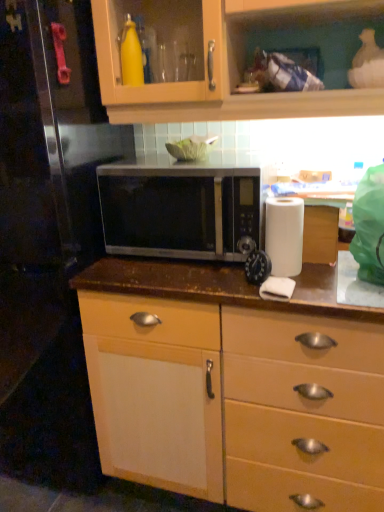
Find the location of a particular element. spots to the right of black plastic clock at center is located at coordinates (331, 282).